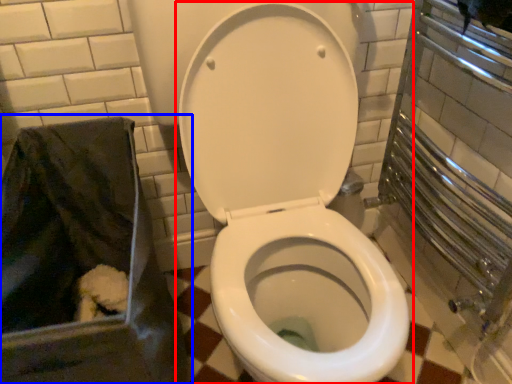
Question: Which point is further to the camera, toilet (highlighted by a red box) or recycling bin (highlighted by a blue box)?

Choices:
 (A) toilet
 (B) recycling bin

Answer: (B)